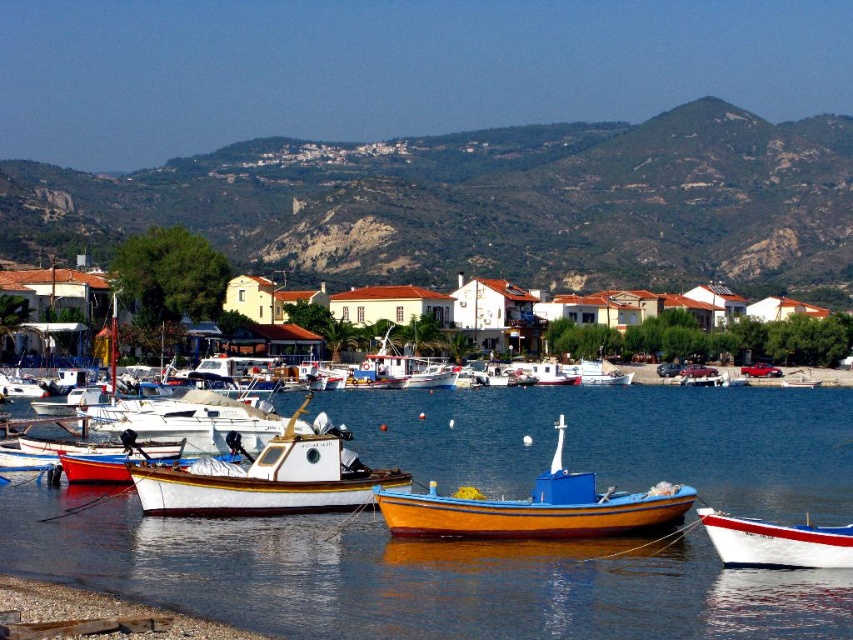
Is point (552, 208) farther from viewer compared to point (581, 499)?

Yes.

Who is higher up, brown rocky mountain at upper center or wooden boat at center?

brown rocky mountain at upper center is above.

Does point (579, 250) come farther from viewer compared to point (553, 452)?

Yes, point (579, 250) is farther from viewer.

Where is `brown rocky mountain at upper center`? brown rocky mountain at upper center is located at coordinates (486, 202).

Which is behind, point (361, 502) or point (770, 566)?

Point (361, 502)

Does white matte boat at center appear under white glossy boat at lower right?

Incorrect, white matte boat at center is not positioned below white glossy boat at lower right.

Image resolution: width=853 pixels, height=640 pixels. Identify the location of white matte boat at center. (267, 480).

Who is positioned more to the right, brown rocky mountain at upper center or white matte boat at center?

From the viewer's perspective, brown rocky mountain at upper center appears more on the right side.

Between point (251, 195) and point (349, 509), which one is positioned in front?

Point (349, 509)

The image size is (853, 640). What are the coordinates of `brown rocky mountain at upper center` in the screenshot? It's located at (486, 202).